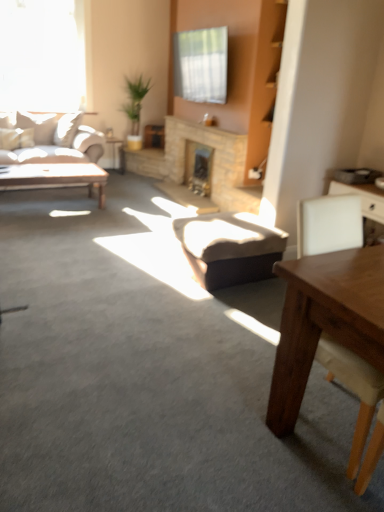
Image resolution: width=384 pixels, height=512 pixels. Find the location of `wooden table at lower right`. wooden table at lower right is located at coordinates (325, 321).

The width and height of the screenshot is (384, 512). Describe the element at coordinates (325, 321) in the screenshot. I see `wooden table at lower right` at that location.

Measure the distance between brick fireplace at center, marked as the second fireplace in a front-to-back arrangement, and camera.

brick fireplace at center, marked as the second fireplace in a front-to-back arrangement, is 4.82 meters away from camera.

What do you see at coordinates (229, 248) in the screenshot? The height and width of the screenshot is (512, 384). I see `dark brown leather stool at center` at bounding box center [229, 248].

This screenshot has width=384, height=512. Find the location of `natural stone fireplace at center, the second fireplace when ordered from back to front`. natural stone fireplace at center, the second fireplace when ordered from back to front is located at coordinates (210, 162).

Where is `matte wooden coffee table at left`? This screenshot has width=384, height=512. matte wooden coffee table at left is located at coordinates (54, 177).

Find the location of a particular element. wooden table at lower right is located at coordinates (325, 321).

Is natural stone fireplace at center, acting as the first fireplace starting from the front, taller or shorter than matte wooden coffee table at left?

natural stone fireplace at center, acting as the first fireplace starting from the front, is taller than matte wooden coffee table at left.

Does natural stone fireplace at center, acting as the first fireplace starting from the front, lie in front of matte wooden coffee table at left?

No, natural stone fireplace at center, acting as the first fireplace starting from the front, is further to the viewer.

Considering the points (220, 178) and (5, 168), which point is behind, point (220, 178) or point (5, 168)?

The point (220, 178) is more distant.

How many degrees apart are the facing directions of natural stone fireplace at center, acting as the first fireplace starting from the front, and matte wooden coffee table at left?

natural stone fireplace at center, acting as the first fireplace starting from the front, and matte wooden coffee table at left are facing 88.2 degrees away from each other.

From their relative heights in the image, would you say matte black side table at left is taller or shorter than natural stone fireplace at center, acting as the first fireplace starting from the front?

In the image, matte black side table at left appears to be shorter than natural stone fireplace at center, acting as the first fireplace starting from the front.

Is matte black side table at left located outside natural stone fireplace at center, acting as the first fireplace starting from the front?

Yes, matte black side table at left is not within natural stone fireplace at center, acting as the first fireplace starting from the front.

Is matte black side table at left looking in the opposite direction of natural stone fireplace at center, the second fireplace when ordered from back to front?

No, matte black side table at left is not facing the opposite direction of natural stone fireplace at center, the second fireplace when ordered from back to front.

Does matte black side table at left appear on the right side of natural stone fireplace at center, the second fireplace when ordered from back to front?

In fact, matte black side table at left is to the left of natural stone fireplace at center, the second fireplace when ordered from back to front.

Considering the positions of point (81, 174) and point (231, 140), is point (81, 174) closer or farther from the camera than point (231, 140)?

Clearly, point (81, 174) is more distant from the camera than point (231, 140).

Is matte wooden coffee table at left smaller than natural stone fireplace at center, acting as the first fireplace starting from the front?

Actually, matte wooden coffee table at left might be larger than natural stone fireplace at center, acting as the first fireplace starting from the front.

Image resolution: width=384 pixels, height=512 pixels. In order to click on fireplace that is the 1st one when counting backward from the matte wooden coffee table at left in this screenshot , I will do `click(210, 162)`.

Looking at this image, does matte wooden coffee table at left touch natural stone fireplace at center, acting as the first fireplace starting from the front?

No, matte wooden coffee table at left is not making contact with natural stone fireplace at center, acting as the first fireplace starting from the front.

At what (x,y) coordinates should I click in order to perform the action: click on stool to the right of matte black side table at left. Please return your answer as a coordinate pair (x, y). This screenshot has width=384, height=512. Looking at the image, I should click on (229, 248).

Visually, is dark brown leather stool at center positioned to the left or to the right of matte black side table at left?

From the image, it's evident that dark brown leather stool at center is to the right of matte black side table at left.

From the image's perspective, which one is positioned higher, dark brown leather stool at center or matte black side table at left?

matte black side table at left appears higher in the image.

Who is taller, brick fireplace at center, which is the 1th fireplace from back to front, or matte wooden coffee table at left?

With more height is brick fireplace at center, which is the 1th fireplace from back to front.

From a real-world perspective, between brick fireplace at center, which is the 1th fireplace from back to front, and matte wooden coffee table at left, who is vertically higher?

In real-world perspective, brick fireplace at center, which is the 1th fireplace from back to front, is above.

Can you tell me how much brick fireplace at center, which is the 1th fireplace from back to front, and matte wooden coffee table at left differ in facing direction?

88.2 degrees separate the facing orientations of brick fireplace at center, which is the 1th fireplace from back to front, and matte wooden coffee table at left.

How distant is brick fireplace at center, which is the 1th fireplace from back to front, from matte wooden coffee table at left?

They are 4.63 feet apart.

Between transparent glass window at upper left and matte black side table at left, which one appears on the left side from the viewer's perspective?

transparent glass window at upper left is more to the left.

Locate an element on the screen. side table below the transparent glass window at upper left (from a real-world perspective) is located at coordinates (114, 146).

Can you confirm if transparent glass window at upper left is shorter than matte black side table at left?

No.

Is point (42, 79) farther from camera compared to point (116, 141)?

No.

Is matte black side table at left positioned behind brick fireplace at center, marked as the second fireplace in a front-to-back arrangement?

That is True.

From a real-world perspective, which is physically above, matte black side table at left or brick fireplace at center, which is the 1th fireplace from back to front?

brick fireplace at center, which is the 1th fireplace from back to front, is physically above.

Which of these two, matte black side table at left or brick fireplace at center, which is the 1th fireplace from back to front, stands taller?

With more height is brick fireplace at center, which is the 1th fireplace from back to front.

Is brick fireplace at center, which is the 1th fireplace from back to front, surrounded by matte black side table at left?

No, brick fireplace at center, which is the 1th fireplace from back to front, is located outside of matte black side table at left.

Find the location of a particular element. This screenshot has width=384, height=512. coffee table lying below the natural stone fireplace at center, the second fireplace when ordered from back to front (from the image's perspective) is located at coordinates (54, 177).

Where is `the 1st fireplace counting from the right side of the matte black side table at left`? This screenshot has width=384, height=512. the 1st fireplace counting from the right side of the matte black side table at left is located at coordinates (210, 162).

Considering their positions, is natural stone fireplace at center, the second fireplace when ordered from back to front, positioned closer to brick fireplace at center, which is the 1th fireplace from back to front, than matte wooden coffee table at left?

natural stone fireplace at center, the second fireplace when ordered from back to front, is positioned closer to the anchor brick fireplace at center, which is the 1th fireplace from back to front.

Based on the photo, based on their spatial positions, is dark brown leather stool at center or natural stone fireplace at center, the second fireplace when ordered from back to front, further from matte wooden coffee table at left?

dark brown leather stool at center lies further to matte wooden coffee table at left than the other object.

Which object lies further to the anchor point matte wooden coffee table at left, transparent glass window at upper left or dark brown leather stool at center?

dark brown leather stool at center is positioned further to the anchor matte wooden coffee table at left.

Estimate the real-world distances between objects in this image. Which object is closer to natural stone fireplace at center, the second fireplace when ordered from back to front, matte black side table at left or brick fireplace at center, which is the 1th fireplace from back to front?

brick fireplace at center, which is the 1th fireplace from back to front, lies closer to natural stone fireplace at center, the second fireplace when ordered from back to front, than the other object.

Looking at the image, which one is located further to brick fireplace at center, which is the 1th fireplace from back to front, wooden table at lower right or matte black side table at left?

Based on the image, wooden table at lower right appears to be further to brick fireplace at center, which is the 1th fireplace from back to front.

Considering their positions, is dark brown leather stool at center positioned further to matte wooden coffee table at left than transparent glass window at upper left?

Among the two, dark brown leather stool at center is located further to matte wooden coffee table at left.

Looking at this image, considering their positions, is dark brown leather stool at center positioned closer to matte wooden coffee table at left than brick fireplace at center, marked as the second fireplace in a front-to-back arrangement?

The object closer to matte wooden coffee table at left is brick fireplace at center, marked as the second fireplace in a front-to-back arrangement.

From the image, which object appears to be farther from matte wooden coffee table at left, wooden table at lower right or transparent glass window at upper left?

wooden table at lower right.

Locate an element on the screen. The image size is (384, 512). stool located between wooden table at lower right and matte black side table at left in the depth direction is located at coordinates (229, 248).

Locate an element on the screen. This screenshot has width=384, height=512. coffee table situated between transparent glass window at upper left and brick fireplace at center, which is the 1th fireplace from back to front, from left to right is located at coordinates [x=54, y=177].

This screenshot has height=512, width=384. I want to click on window positioned between wooden table at lower right and matte black side table at left from near to far, so click(42, 55).

Identify the location of side table between transparent glass window at upper left and brick fireplace at center, marked as the second fireplace in a front-to-back arrangement. The width and height of the screenshot is (384, 512). (114, 146).